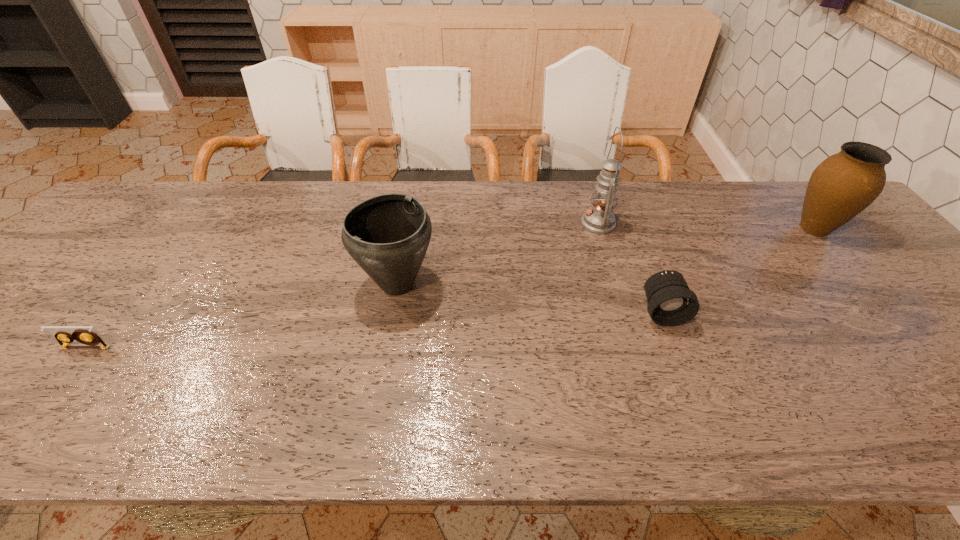
At what (x,y) coordinates should I click in order to perform the action: click on free space located 0.080m on the back of the nearer urn. Please return your answer as a coordinate pair (x, y). This screenshot has height=540, width=960. Looking at the image, I should click on (406, 237).

Where is `free space located 0.170m at the front element of the telephoto lens`? free space located 0.170m at the front element of the telephoto lens is located at coordinates (692, 393).

The image size is (960, 540). In order to click on vacant position located at the front of the leftmost object with visible reels in this screenshot , I will do (64, 377).

This screenshot has height=540, width=960. What are the coordinates of `oil lamp positioned at the far edge` in the screenshot? It's located at (599, 219).

The height and width of the screenshot is (540, 960). I want to click on urn present at the far edge, so click(843, 185).

Where is `object that is at the left edge`? Image resolution: width=960 pixels, height=540 pixels. object that is at the left edge is located at coordinates (82, 335).

Where is `object that is at the right edge`? This screenshot has height=540, width=960. object that is at the right edge is located at coordinates (843, 185).

Image resolution: width=960 pixels, height=540 pixels. I want to click on object positioned at the far right corner, so click(x=843, y=185).

You are a GUI agent. You are given a task and a screenshot of the screen. Output one action in this format:
    pyautogui.click(x=<x>, y=<y>)
    Task: Click on the free spot at the far edge of the desktop
    This screenshot has width=960, height=540.
    Given the screenshot: What is the action you would take?
    pyautogui.click(x=450, y=210)

Locate an element on the screen. The image size is (960, 540). vacant space at the near edge of the desktop is located at coordinates (26, 443).